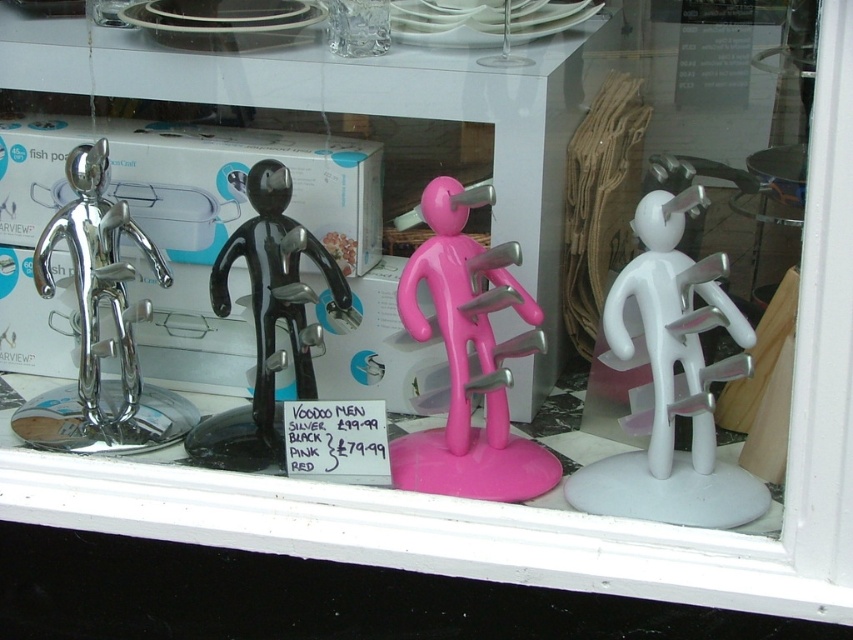
Question: Which of the following is the closest to the observer?

Choices:
 (A) (258, 221)
 (B) (450, 404)
 (C) (125, 314)
 (D) (660, 362)

Answer: (D)

Question: Which point is farther to the camera?

Choices:
 (A) (485, 308)
 (B) (692, 380)
 (C) (239, 243)
 (D) (44, 228)

Answer: (D)

Question: Is polished silver mannequin at left thinner than black glossy voodoo man at center?

Choices:
 (A) yes
 (B) no

Answer: (B)

Question: Which of the following is the farthest from the observer?

Choices:
 (A) (689, 500)
 (B) (450, 449)
 (C) (146, 300)
 (D) (258, 330)

Answer: (C)

Question: In this image, where is pink glossy mannequin at center located relative to black glossy voodoo man at center?

Choices:
 (A) left
 (B) right

Answer: (B)

Question: Is white plastic figure at center positioned in front of black glossy voodoo man at center?

Choices:
 (A) yes
 (B) no

Answer: (A)